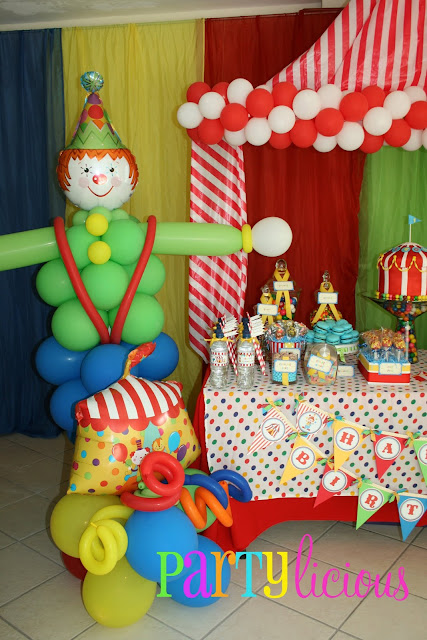
Where is `tile floor`? This screenshot has height=640, width=427. tile floor is located at coordinates coord(246,621).